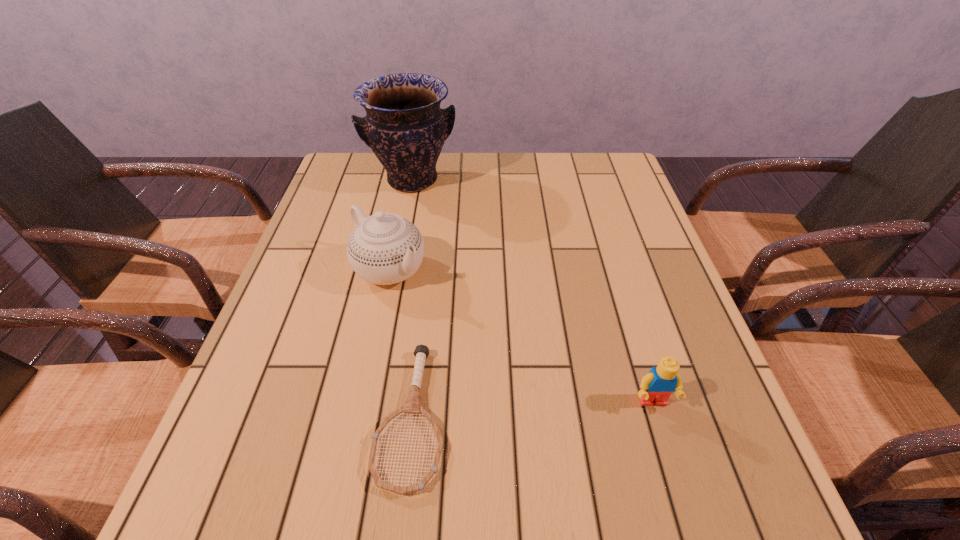
Locate an element on the screen. The height and width of the screenshot is (540, 960). object that is at the far left corner is located at coordinates (405, 127).

Find the location of a particular element. Image resolution: width=960 pixels, height=540 pixels. object at the near right corner is located at coordinates (656, 387).

Identify the location of free location at the far edge of the desktop. Image resolution: width=960 pixels, height=540 pixels. pos(461,179).

Find the location of a particular element. The height and width of the screenshot is (540, 960). free space at the left edge is located at coordinates (286, 339).

Locate an element on the screen. vacant space at the right edge is located at coordinates (657, 297).

The image size is (960, 540). Identify the location of vacant space at the far left corner of the desktop. (342, 153).

I want to click on free space at the far right corner of the desktop, so click(588, 158).

Where is `empty location between the third tallest object and the farthest object`? The height and width of the screenshot is (540, 960). empty location between the third tallest object and the farthest object is located at coordinates (533, 291).

Where is `free spot between the second farthest object and the tennis racket`? free spot between the second farthest object and the tennis racket is located at coordinates (400, 343).

At what (x,y) coordinates should I click in order to perform the action: click on free space between the tallest object and the tennis racket. Please return your answer as a coordinate pair (x, y). The width and height of the screenshot is (960, 540). Looking at the image, I should click on (412, 299).